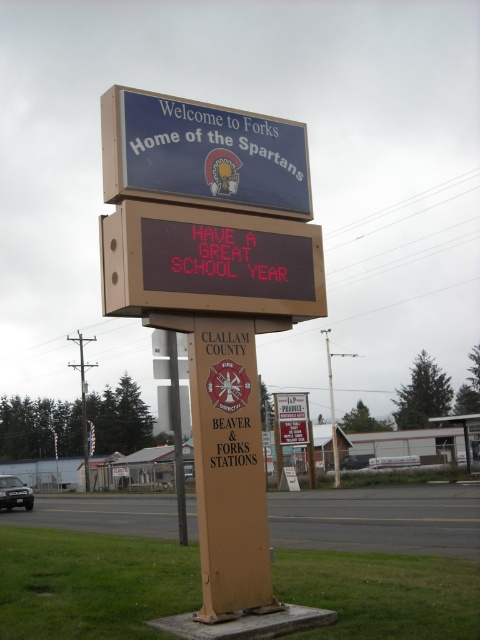
Is blue matte signboard at upper center behind metallic pole at center?

No, it is not.

Is blue matte signboard at upper center to the left of metallic pole at center from the viewer's perspective?

Yes, blue matte signboard at upper center is to the left of metallic pole at center.

Who is more distant from viewer, (301, 166) or (334, 428)?

Point (334, 428)

This screenshot has height=640, width=480. I want to click on blue matte signboard at upper center, so click(x=203, y=154).

Is red led display at center further to the viewer compared to metallic pole at center?

No, red led display at center is in front of metallic pole at center.

Is red led display at center bigger than metallic pole at center?

No.

Which is behind, point (164, 285) or point (336, 476)?

The point (336, 476) is behind.

Where is `red led display at center`? This screenshot has height=640, width=480. red led display at center is located at coordinates (208, 262).

Does point (299, 288) lie behind point (285, 148)?

No, (299, 288) is in front of (285, 148).

Describe the element at coordinates (208, 262) in the screenshot. I see `red led display at center` at that location.

Between point (136, 296) and point (299, 179), which one is positioned behind?

Positioned behind is point (299, 179).

The height and width of the screenshot is (640, 480). What are the coordinates of `red led display at center` in the screenshot? It's located at (208, 262).